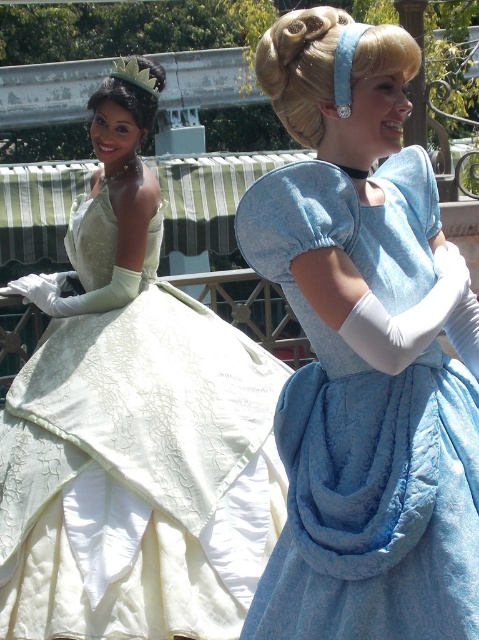
Question: Among these objects, which one is nearest to the camera?

Choices:
 (A) matte blue dress at center
 (B) silver metallic tiara at upper left
 (C) matte green gown at center

Answer: (A)

Question: Among these points, which one is farthest from the camera?

Choices:
 (A) (304, 488)
 (B) (145, 72)

Answer: (B)

Question: Can you confirm if matte green gown at center is thinner than silver metallic tiara at upper left?

Choices:
 (A) yes
 (B) no

Answer: (A)

Question: Among these points, which one is nearest to the camera?

Choices:
 (A) (358, 474)
 (B) (94, 248)
 (C) (138, 68)

Answer: (A)

Question: Can you confirm if matte blue dress at center is positioned to the left of silver metallic tiara at upper left?

Choices:
 (A) no
 (B) yes

Answer: (A)

Question: Is matte blue dress at center below matte green gown at center?

Choices:
 (A) yes
 (B) no

Answer: (B)